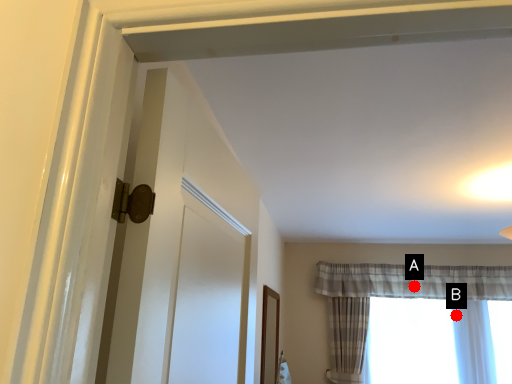
Question: Two points are circled on the image, labeled by A and B beside each circle. Which point is farther to the camera?

Choices:
 (A) A is further
 (B) B is further

Answer: (A)